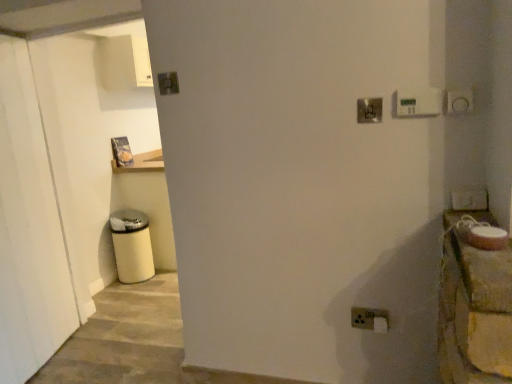
Question: Is white plastic thermostat at upper right, which is counted as the 3th light switch, starting from the left, smaller than metallic square at upper center, the 1th light switch when ordered from left to right?

Choices:
 (A) yes
 (B) no

Answer: (B)

Question: Can you confirm if white plastic thermostat at upper right, the second light switch when ordered from top to bottom, is wider than metallic square at upper center, the fourth light switch in the right-to-left sequence?

Choices:
 (A) yes
 (B) no

Answer: (A)

Question: From a real-world perspective, is white plastic thermostat at upper right, which is the third light switch in bottom-to-top order, physically above metallic square at upper center, which ranks as the fourth light switch in bottom-to-top order?

Choices:
 (A) yes
 (B) no

Answer: (B)

Question: Would you say white plastic thermostat at upper right, which is the first light switch from front to back, is a long distance from metallic square at upper center, the fourth light switch in the front-to-back sequence?

Choices:
 (A) no
 (B) yes

Answer: (A)

Question: Does white plastic thermostat at upper right, the second light switch when ordered from top to bottom, have a lesser height compared to metallic square at upper center, placed as the first light switch when sorted from back to front?

Choices:
 (A) no
 (B) yes

Answer: (A)

Question: Does white plastic thermostat at upper right, the 4th light switch in the back-to-front sequence, have a lesser width compared to metallic square at upper center, the fourth light switch in the right-to-left sequence?

Choices:
 (A) yes
 (B) no

Answer: (B)

Question: Is metallic square at upper center, the fourth light switch in the right-to-left sequence, shorter than white plastic thermostat at upper right, which is the third light switch in bottom-to-top order?

Choices:
 (A) no
 (B) yes

Answer: (B)

Question: Is metallic square at upper center, marked as the first light switch in a top-to-bottom arrangement, wider than white plastic thermostat at upper right, which is counted as the 3th light switch, starting from the left?

Choices:
 (A) no
 (B) yes

Answer: (A)

Question: Considering the relative sizes of metallic square at upper center, the 1th light switch when ordered from left to right, and white plastic thermostat at upper right, which is the third light switch in bottom-to-top order, in the image provided, is metallic square at upper center, the 1th light switch when ordered from left to right, thinner than white plastic thermostat at upper right, which is the third light switch in bottom-to-top order,?

Choices:
 (A) yes
 (B) no

Answer: (A)

Question: Does metallic square at upper center, placed as the first light switch when sorted from back to front, turn towards white plastic thermostat at upper right, which is the third light switch in bottom-to-top order?

Choices:
 (A) yes
 (B) no

Answer: (B)

Question: Is metallic square at upper center, the fourth light switch in the front-to-back sequence, positioned with its back to white plastic thermostat at upper right, the 4th light switch in the back-to-front sequence?

Choices:
 (A) no
 (B) yes

Answer: (A)

Question: Is metallic square at upper center, which ranks as the fourth light switch in bottom-to-top order, behind white plastic thermostat at upper right, marked as the 2th light switch in a right-to-left arrangement?

Choices:
 (A) yes
 (B) no

Answer: (A)

Question: Is white plastic thermostat at upper right, which is the first light switch from front to back, located within metallic silver switch at upper right, which ranks as the 3th light switch in top-to-bottom order?

Choices:
 (A) no
 (B) yes

Answer: (A)